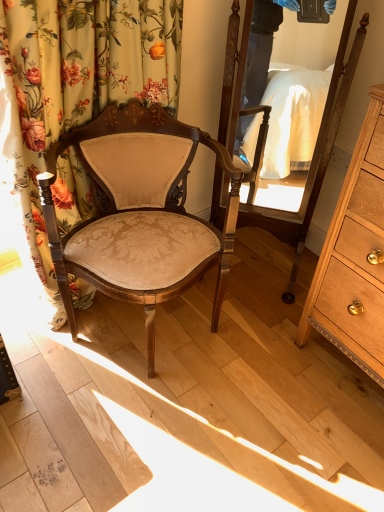
I want to click on free space on the front side of wooden mirror at center, so (x=261, y=322).